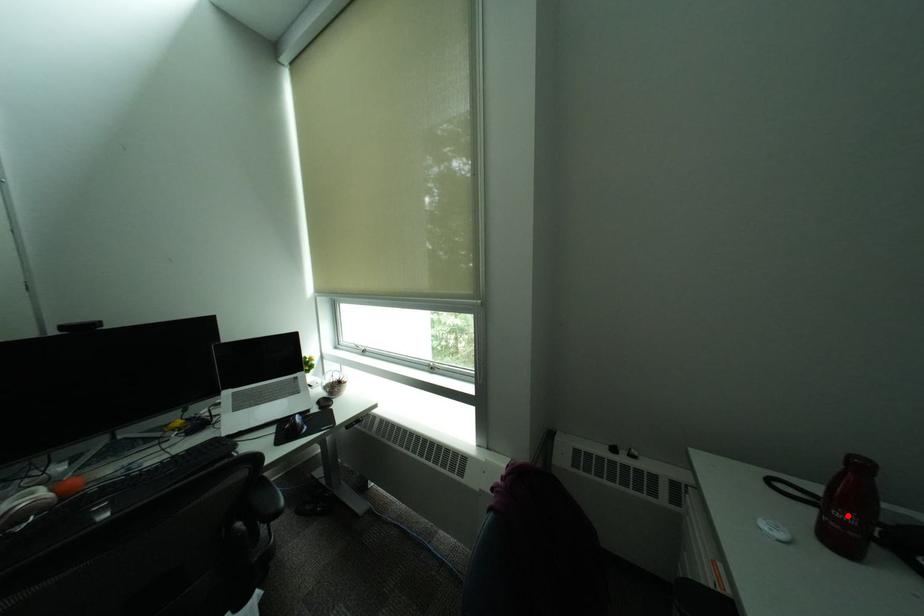
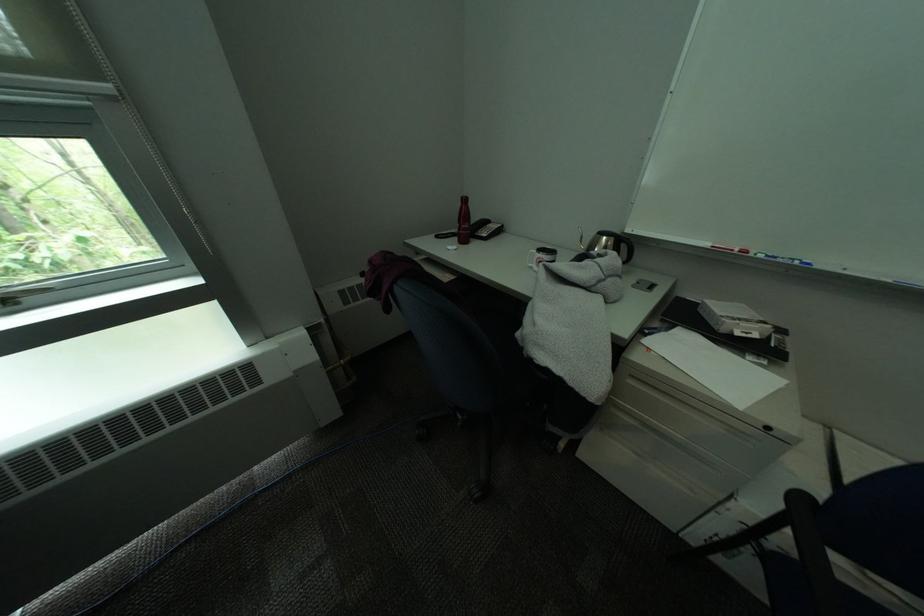
Where in the second image is the point corresponding to the highlighted location from the first image?

(475, 228)